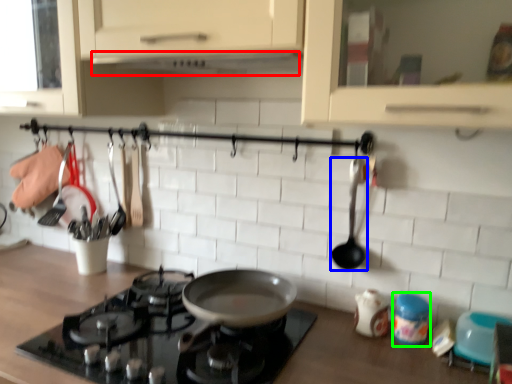
Question: Which object is the closest to the exhaust hood (highlighted by a red box)? Choose among these: spoon (highlighted by a blue box) or appliance (highlighted by a green box).

Choices:
 (A) spoon
 (B) appliance

Answer: (A)